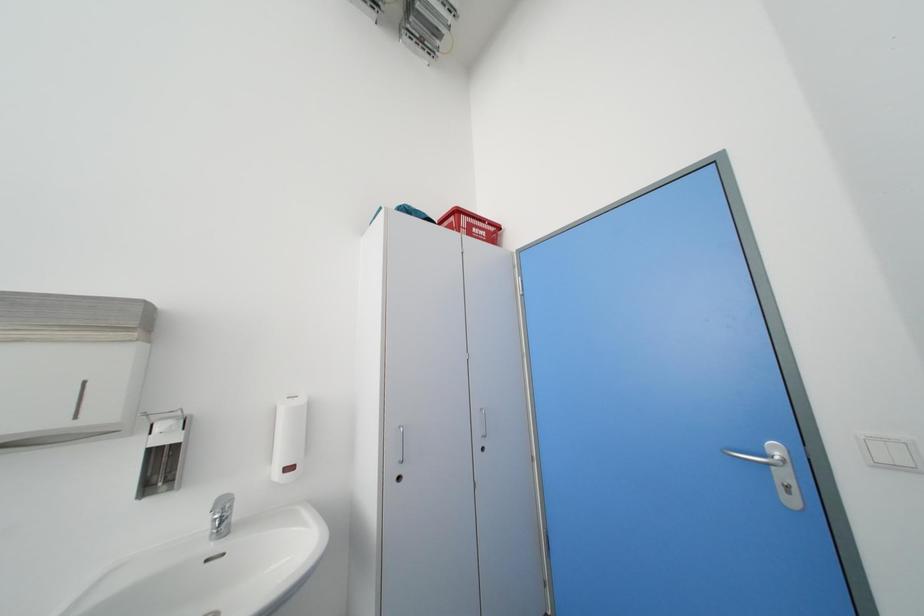
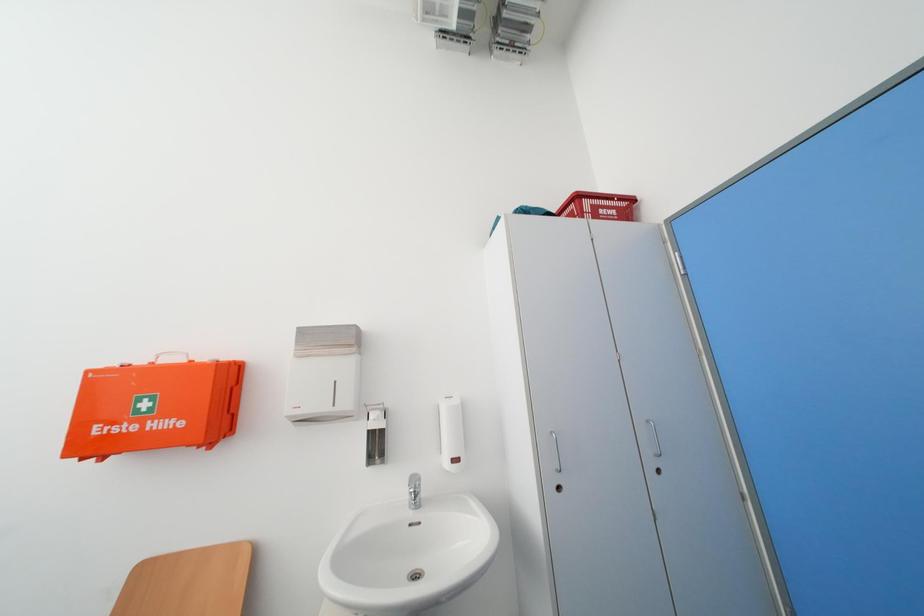
Question: Which direction would the cameraman need to move to produce the second image? Reply with the corresponding letter.

Choices:
 (A) Left
 (B) Right
 (C) Forward
 (D) Backward

Answer: (A)